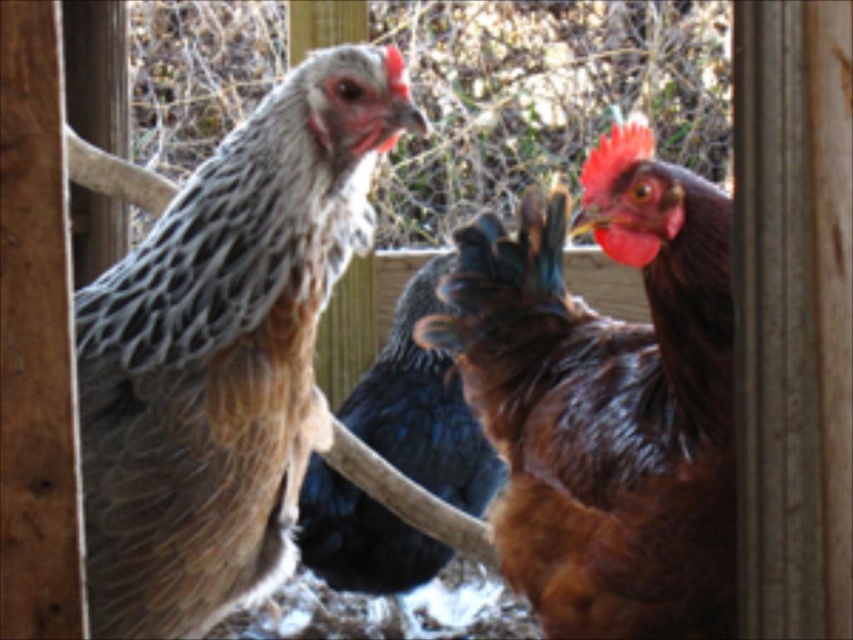
Which is behind, point (241, 211) or point (445, 484)?

The point (445, 484) is behind.

Who is more forward, (260, 408) or (421, 536)?

Positioned in front is point (260, 408).

The image size is (853, 640). What do you see at coordinates (225, 352) in the screenshot? I see `speckled feathered chicken at left` at bounding box center [225, 352].

Identify the location of speckled feathered chicken at left. This screenshot has width=853, height=640. (225, 352).

From the picture: Does brown glossy chicken at right have a larger size compared to shiny black feathers at center?

Correct, brown glossy chicken at right is larger in size than shiny black feathers at center.

Is brown glossy chicken at right taller than shiny black feathers at center?

Correct, brown glossy chicken at right is much taller as shiny black feathers at center.

Is point (577, 545) positioned after point (383, 593)?

No, it is not.

Locate an element on the screen. This screenshot has height=640, width=853. brown glossy chicken at right is located at coordinates (607, 400).

Image resolution: width=853 pixels, height=640 pixels. I want to click on speckled feathered chicken at left, so click(225, 352).

Can you confirm if speckled feathered chicken at left is positioned below brown glossy chicken at right?

Incorrect, speckled feathered chicken at left is not positioned below brown glossy chicken at right.

Does point (242, 246) come in front of point (534, 396)?

Yes, point (242, 246) is closer to viewer.

Where is `speckled feathered chicken at left`? The width and height of the screenshot is (853, 640). speckled feathered chicken at left is located at coordinates (225, 352).